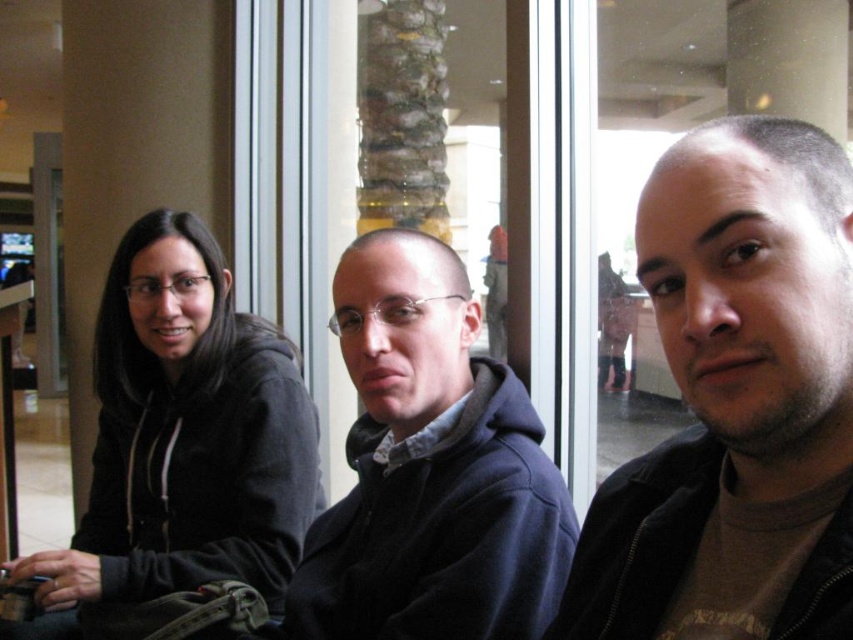
Does point (663, 604) come in front of point (485, 380)?

Yes.

Which is behind, point (769, 196) or point (453, 282)?

The point (453, 282) is behind.

Locate an element on the screen. The width and height of the screenshot is (853, 640). dark brown leather jacket at center is located at coordinates (735, 400).

Describe the element at coordinates (735, 400) in the screenshot. Image resolution: width=853 pixels, height=640 pixels. I see `dark brown leather jacket at center` at that location.

Who is positioned more to the right, dark brown leather jacket at center or black hoodie at left?

Positioned to the right is dark brown leather jacket at center.

The width and height of the screenshot is (853, 640). What do you see at coordinates (735, 400) in the screenshot?
I see `dark brown leather jacket at center` at bounding box center [735, 400].

Where is `dark brown leather jacket at center`? This screenshot has width=853, height=640. dark brown leather jacket at center is located at coordinates (735, 400).

Can you confirm if dark blue hoodie at center is taller than black hoodie at left?

In fact, dark blue hoodie at center may be shorter than black hoodie at left.

Is dark blue hoodie at center thinner than black hoodie at left?

Correct, dark blue hoodie at center's width is less than black hoodie at left's.

Which is in front, point (416, 444) or point (206, 248)?

Positioned in front is point (416, 444).

Find the location of `dark blue hoodie at center`. dark blue hoodie at center is located at coordinates (430, 468).